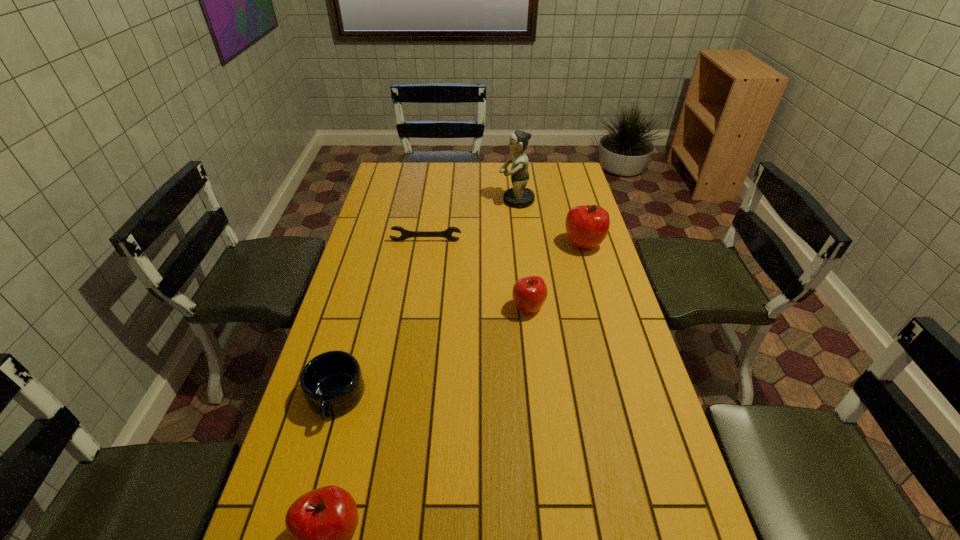
At what (x,y) coordinates should I click in order to perform the action: click on vacant space located on the front of the rightmost object. Please return your answer as a coordinate pair (x, y). The image size is (960, 540). Looking at the image, I should click on (594, 281).

Where is `vacant position located on the front-facing side of the figurine`? vacant position located on the front-facing side of the figurine is located at coordinates (403, 200).

At what (x,y) coordinates should I click in order to perform the action: click on blank space located 0.130m on the front-facing side of the figurine. Please return your answer as a coordinate pair (x, y). Looking at the image, I should click on (468, 200).

Locate an element on the screen. This screenshot has height=540, width=960. free location located on the front-facing side of the figurine is located at coordinates (463, 200).

The image size is (960, 540). I want to click on free point located with the handle on the side of the second nearest object, so click(x=318, y=462).

Identify the location of free point located 0.250m on the open ends of the shortest object. (419, 288).

Find the location of a particular element. The height and width of the screenshot is (540, 960). mug at the left edge is located at coordinates (332, 383).

You are a GUI agent. You are given a task and a screenshot of the screen. Output one action in this format:
    pyautogui.click(x=<x>, y=<y>)
    Task: Click on the wrench positioned at the left edge
    The height and width of the screenshot is (540, 960).
    Given the screenshot: What is the action you would take?
    pyautogui.click(x=405, y=234)

This screenshot has width=960, height=540. I want to click on object that is at the right edge, so click(x=587, y=226).

The image size is (960, 540). In the image, there is a desktop. Find the location of `free space at the far edge`. free space at the far edge is located at coordinates (440, 165).